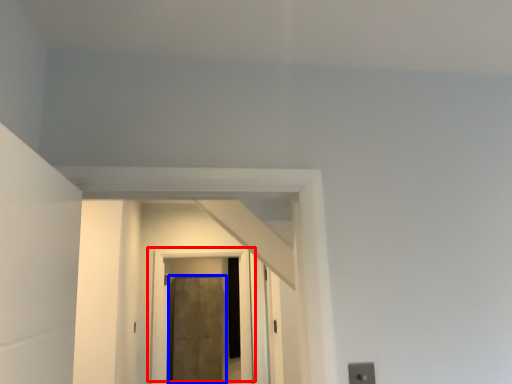
Question: Among these objects, which one is nearest to the camera, door (highlighted by a red box) or door (highlighted by a blue box)?

Choices:
 (A) door
 (B) door

Answer: (A)